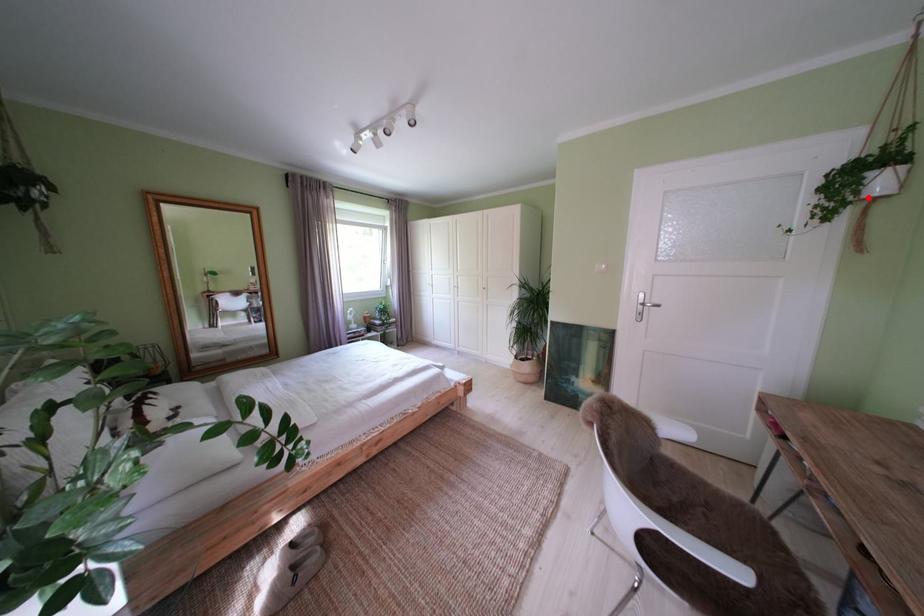
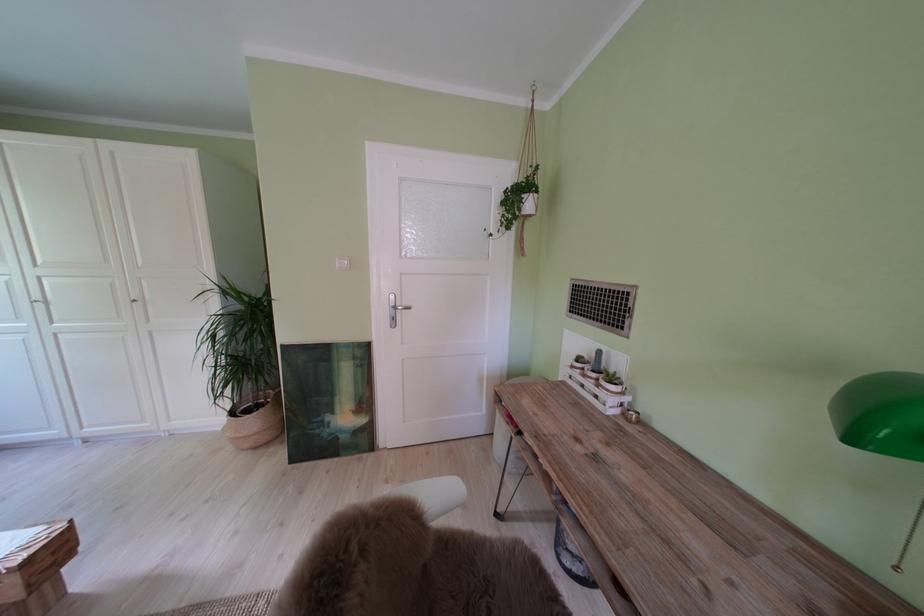
Question: I am providing you with two images of the same scene from different viewpoints. A red point is shown in image1. For the corresponding object point in image2, is it positioned nearer or farther from the camera?

Choices:
 (A) Nearer
 (B) Farther

Answer: (A)